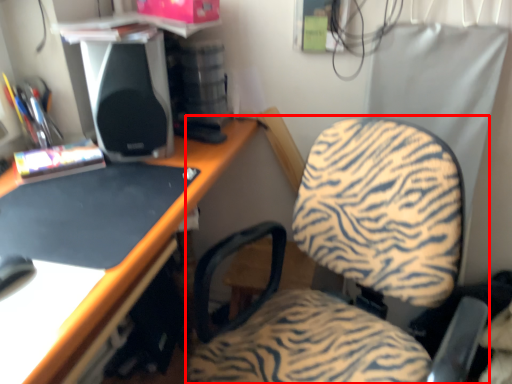
Question: In this image, where is chair (annotated by the red box) located relative to speaker?

Choices:
 (A) left
 (B) right

Answer: (B)